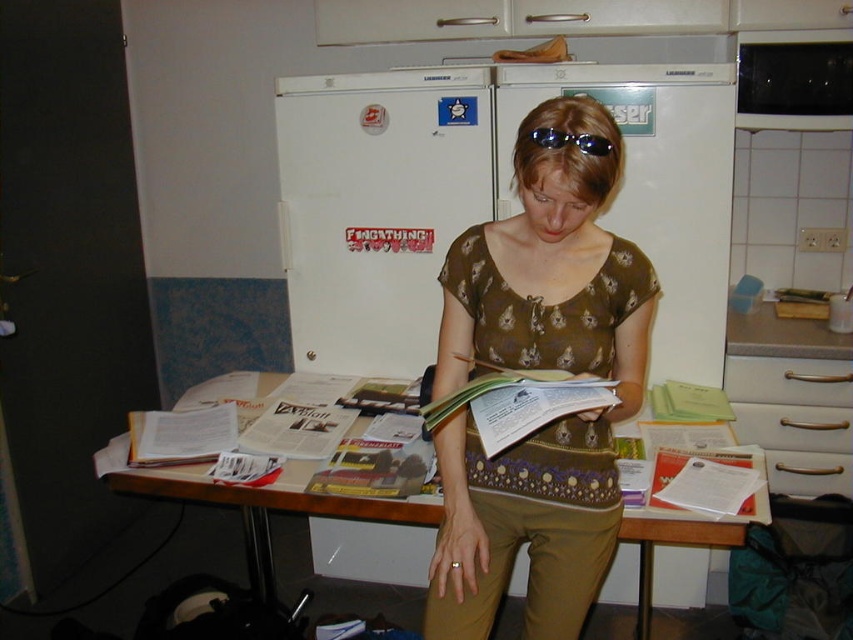
Who is taller, brown printed shirt at center or green paper book at center?

Standing taller between the two is brown printed shirt at center.

Does brown printed shirt at center have a greater height compared to green paper book at center?

Yes, brown printed shirt at center is taller than green paper book at center.

Which is behind, point (427, 628) or point (494, 401)?

Point (427, 628)

The height and width of the screenshot is (640, 853). I want to click on brown printed shirt at center, so click(x=538, y=368).

Which is more to the right, silver metallic drawer at right or white matte drawer at lower right?

From the viewer's perspective, silver metallic drawer at right appears more on the right side.

Does silver metallic drawer at right lie behind white matte drawer at lower right?

No, it is in front of white matte drawer at lower right.

At what (x,y) coordinates should I click in order to perform the action: click on silver metallic drawer at right. Please return your answer as a coordinate pair (x, y). This screenshot has width=853, height=640. Looking at the image, I should click on (795, 419).

This screenshot has width=853, height=640. Identify the location of silver metallic drawer at right. (795, 419).

Describe the element at coordinates (795, 419) in the screenshot. The image size is (853, 640). I see `silver metallic drawer at right` at that location.

Can you confirm if silver metallic drawer at right is thinner than white paper book at center?

Incorrect, silver metallic drawer at right's width is not less than white paper book at center's.

Between point (738, 432) and point (682, 484), which one is positioned behind?

Positioned behind is point (738, 432).

Find the location of a particular element. silver metallic drawer at right is located at coordinates (795, 419).